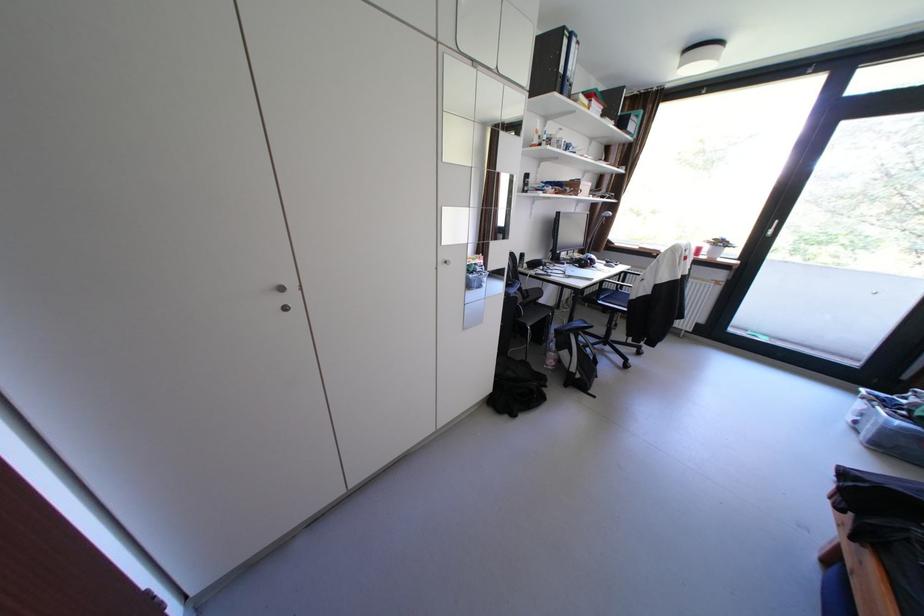
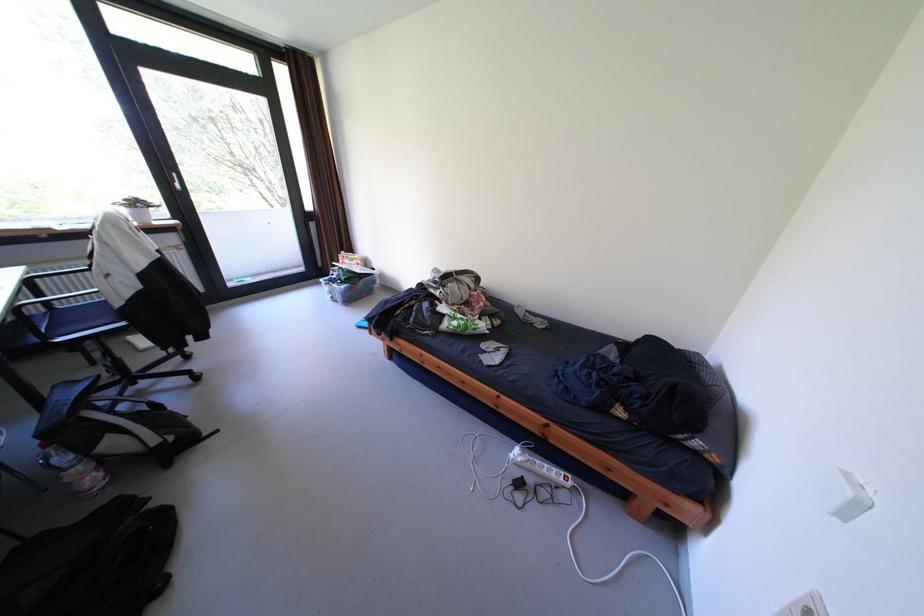
Where in the second image is the point corresponding to point 732,244 from the first image?

(149, 205)